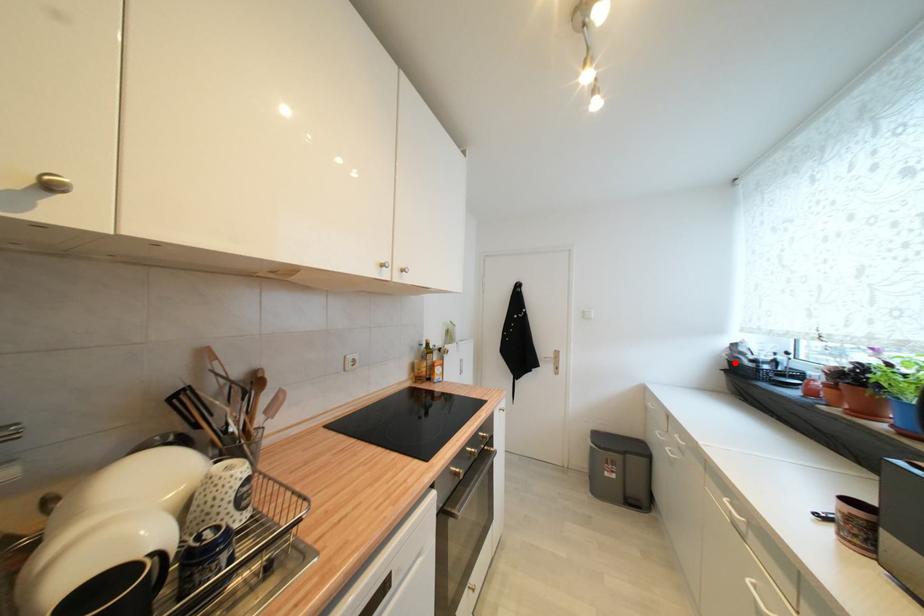
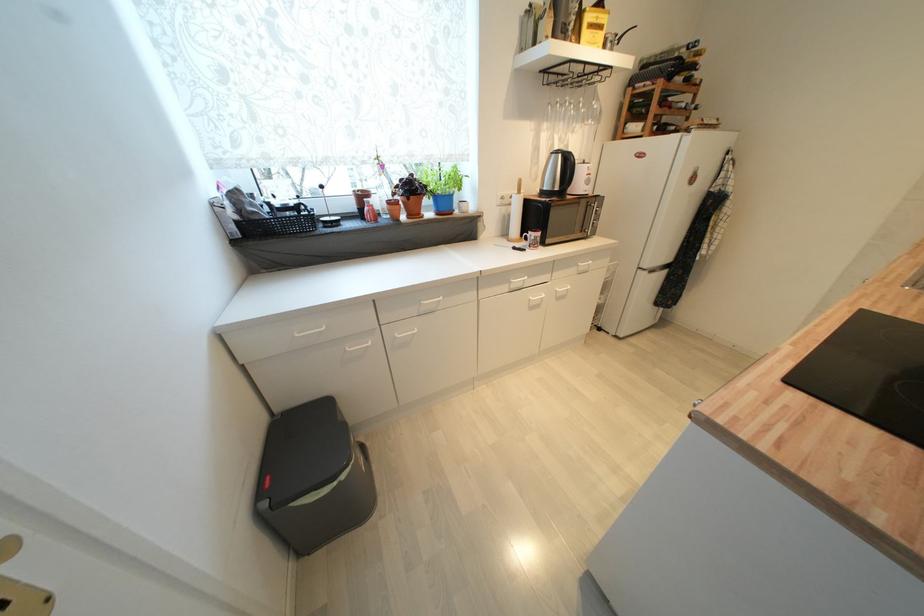
The point at the highlighted location is marked in the first image. Where is the corresponding point in the second image?

(242, 225)